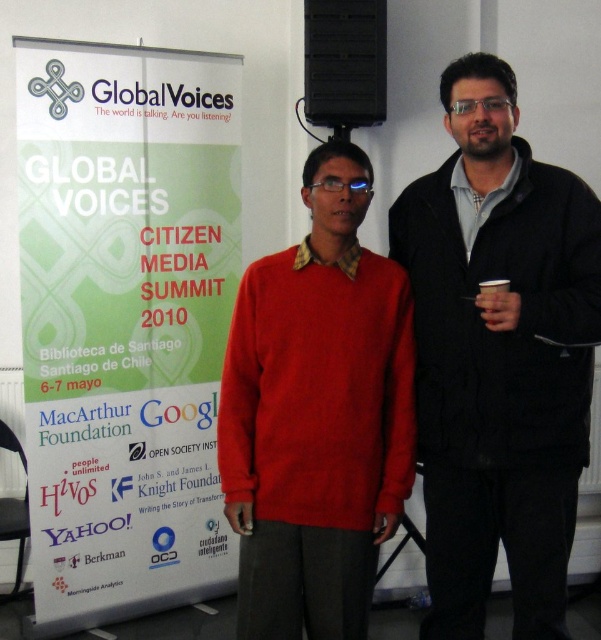
Is black matte jacket at right shorter than matte red sweater at center?

In fact, black matte jacket at right may be taller than matte red sweater at center.

Between black matte jacket at right and matte red sweater at center, which one appears on the right side from the viewer's perspective?

Positioned to the right is black matte jacket at right.

The height and width of the screenshot is (640, 601). What do you see at coordinates (498, 356) in the screenshot?
I see `black matte jacket at right` at bounding box center [498, 356].

I want to click on black matte jacket at right, so click(x=498, y=356).

Is point (28, 300) less distant than point (489, 536)?

No, (28, 300) is behind (489, 536).

Locate an element on the screen. Image resolution: width=601 pixels, height=640 pixels. white paper poster at left is located at coordinates (124, 321).

Locate an element on the screen. This screenshot has height=640, width=601. white paper poster at left is located at coordinates (124, 321).

Is the position of matte red sweater at center less distant than that of black paper cup at right?

No, it is behind black paper cup at right.

Which is in front, point (388, 273) or point (480, 292)?

Positioned in front is point (480, 292).

Who is more forward, (242,560) or (490,291)?

Point (490,291)

At what (x,y) coordinates should I click in order to perform the action: click on matte red sweater at center. Please return your answer as a coordinate pair (x, y). The height and width of the screenshot is (640, 601). Looking at the image, I should click on (316, 413).